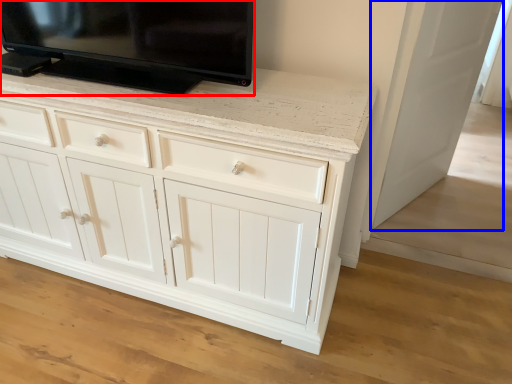
Question: Which object appears farthest to the camera in this image, television (highlighted by a red box) or door (highlighted by a blue box)?

Choices:
 (A) television
 (B) door

Answer: (B)